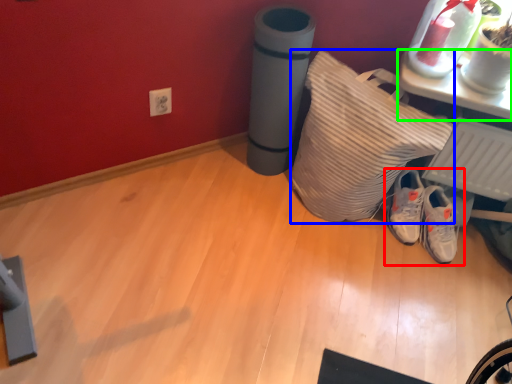
Question: Which object is positioned farthest from footwear (highlighted by a red box)? Select from pillow (highlighted by a blue box) and furniture (highlighted by a green box).

Choices:
 (A) pillow
 (B) furniture

Answer: (B)